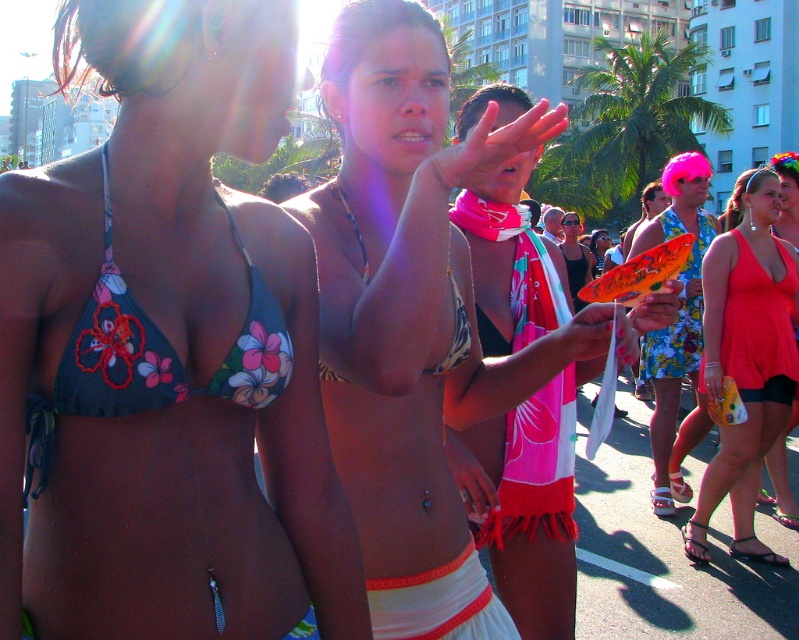
You are a photographer trying to capture a clear shot of both the floral bikini top at center and the pink fabric scarf at center. Since you want both subjects to be fully visible in your frame, which object should you focus on first to ensure the taller one is in focus?

The floral bikini top at center is much taller than the pink fabric scarf at center, so you should focus on the floral bikini top at center first to ensure it is in focus before adjusting for the smaller one.

You are a photographer at the event and want to capture both the floral fabric dress at center and the floral print bikini at center in a single frame. Which one will appear wider in the photo?

The floral fabric dress at center will appear wider in the photo because its width surpasses that of the floral print bikini at center.